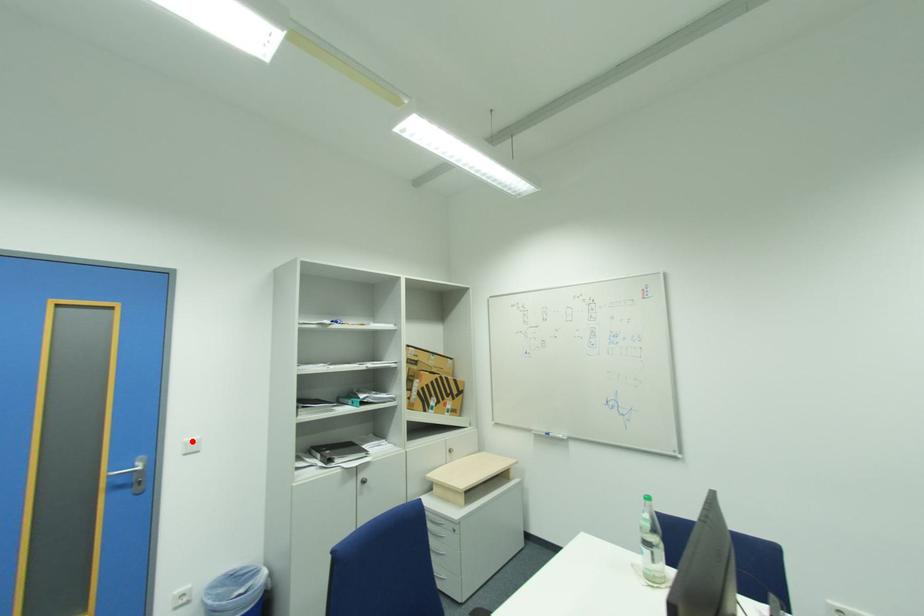
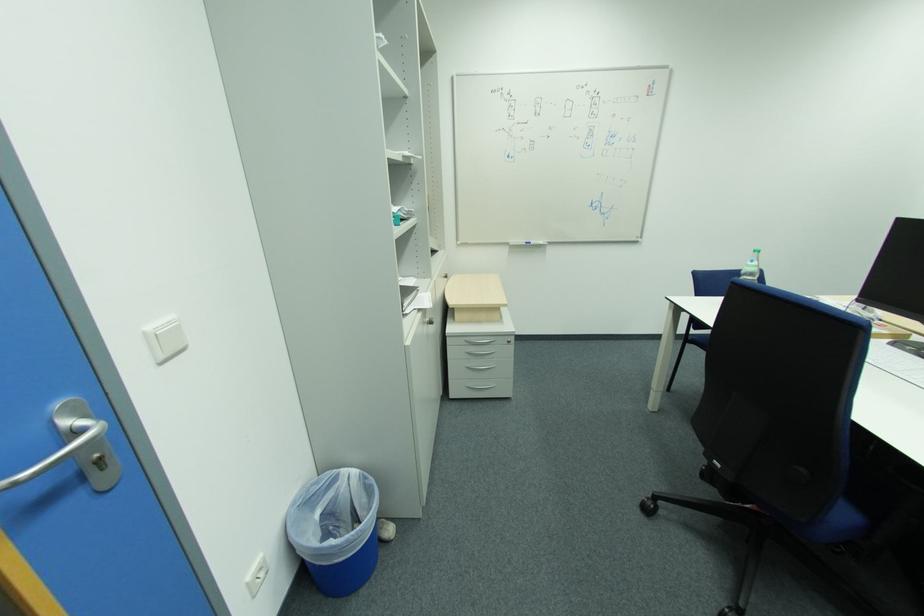
Where in the second image is the point corresponding to the highlighted location from the first image?

(154, 329)